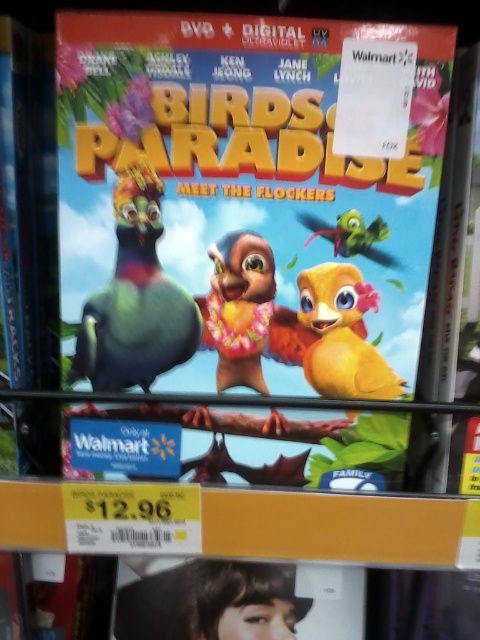
Question: Which of these objects is positioned closest to the yellow matte bird at center?

Choices:
 (A) green matte bird at upper center
 (B) matte green bird at center

Answer: (A)

Question: Can you confirm if yellow matte bird at center is smaller than green matte bird at upper center?

Choices:
 (A) yes
 (B) no

Answer: (B)

Question: Among these objects, which one is nearest to the camera?

Choices:
 (A) green matte bird at upper center
 (B) matte green bird at center

Answer: (B)

Question: Is matte green bird at center positioned before yellow matte bird at center?

Choices:
 (A) no
 (B) yes

Answer: (B)

Question: Which of the following is the farthest from the observer?

Choices:
 (A) (373, 369)
 (B) (351, 211)

Answer: (A)

Question: Is yellow matte bird at center below green matte bird at upper center?

Choices:
 (A) no
 (B) yes

Answer: (B)